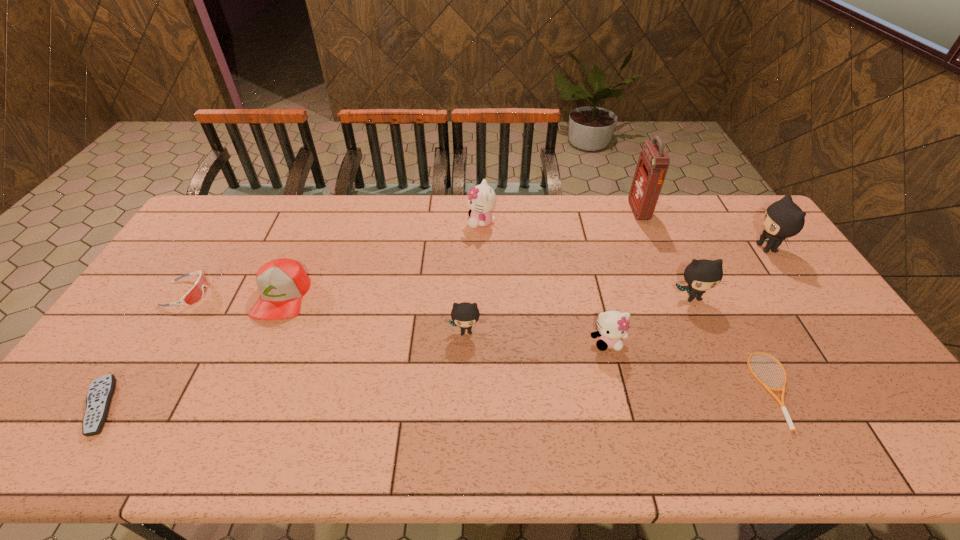
This screenshot has width=960, height=540. I want to click on the first-aid kit, so click(653, 163).

Locate an element on the screen. The width and height of the screenshot is (960, 540). the tallest object is located at coordinates (653, 163).

The width and height of the screenshot is (960, 540). Find the location of `the biggest gray kitten`. the biggest gray kitten is located at coordinates (783, 219).

Find the location of a particular element. The height and width of the screenshot is (540, 960). the rightmost kitten is located at coordinates (783, 219).

Locate an element on the screen. the bigger white kitten is located at coordinates (482, 199).

This screenshot has height=540, width=960. Identify the location of the left white kitten. (482, 199).

The image size is (960, 540). In order to click on the second gray kitten from left to right in this screenshot , I will do `click(701, 275)`.

Find the location of a particular element. This screenshot has width=960, height=540. the fourth kitten from left to right is located at coordinates (701, 275).

At what (x,y) coordinates should I click in order to perform the action: click on the sixth object from left to right. Please return your answer as a coordinate pair (x, y). This screenshot has height=540, width=960. Looking at the image, I should click on (612, 325).

This screenshot has width=960, height=540. What are the coordinates of `the third kitten from left to right` in the screenshot? It's located at (612, 325).